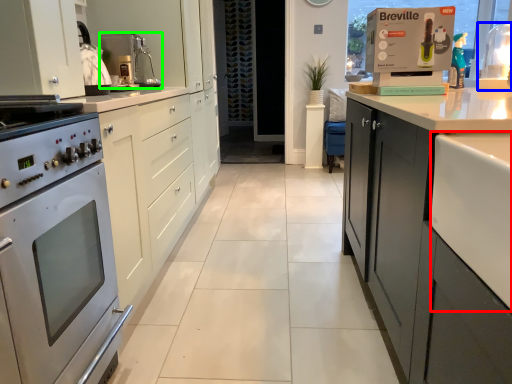
Question: Which is nearer to the counter top (highlighted by a red box)? appliance (highlighted by a blue box) or kitchen appliance (highlighted by a green box).

Choices:
 (A) appliance
 (B) kitchen appliance

Answer: (B)